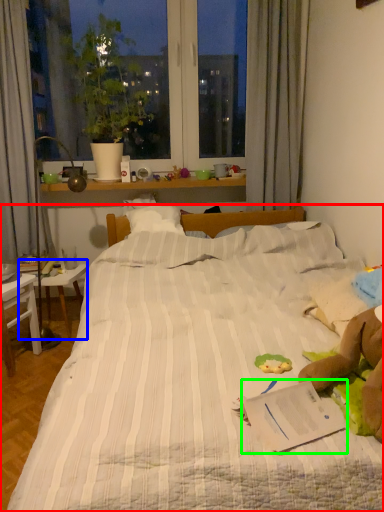
Question: Which object is positioned farthest from bed (highlighted by a red box)? Select from table (highlighted by a blue box) and paperback book (highlighted by a green box).

Choices:
 (A) table
 (B) paperback book

Answer: (A)